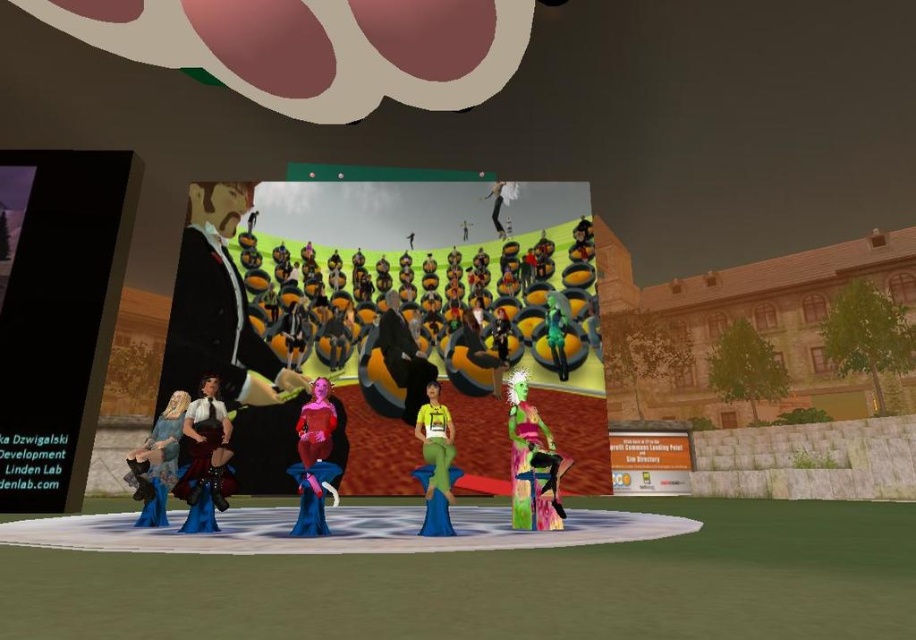
Does smooth black suit at center appear on the left side of green matte figure at center?

Yes, smooth black suit at center is to the left of green matte figure at center.

Consider the image. Which is more to the right, smooth black suit at center or green matte figure at center?

Positioned to the right is green matte figure at center.

Is point (192, 384) in front of point (557, 376)?

Yes, it is.

Locate an element on the screen. The image size is (916, 640). smooth black suit at center is located at coordinates (217, 308).

Is velvet maroon dress at center to the right of blue velvet dress at lower left from the viewer's perspective?

Indeed, velvet maroon dress at center is positioned on the right side of blue velvet dress at lower left.

Locate an element on the screen. velvet maroon dress at center is located at coordinates (203, 458).

Is multicolored fabric superhero at center above shiny black dress at center?

Yes, multicolored fabric superhero at center is above shiny black dress at center.

Which is behind, point (543, 444) or point (564, 461)?

The point (543, 444) is behind.

At what (x,y) coordinates should I click in order to perform the action: click on multicolored fabric superhero at center. Please return your answer as a coordinate pair (x, y). Looking at the image, I should click on (532, 461).